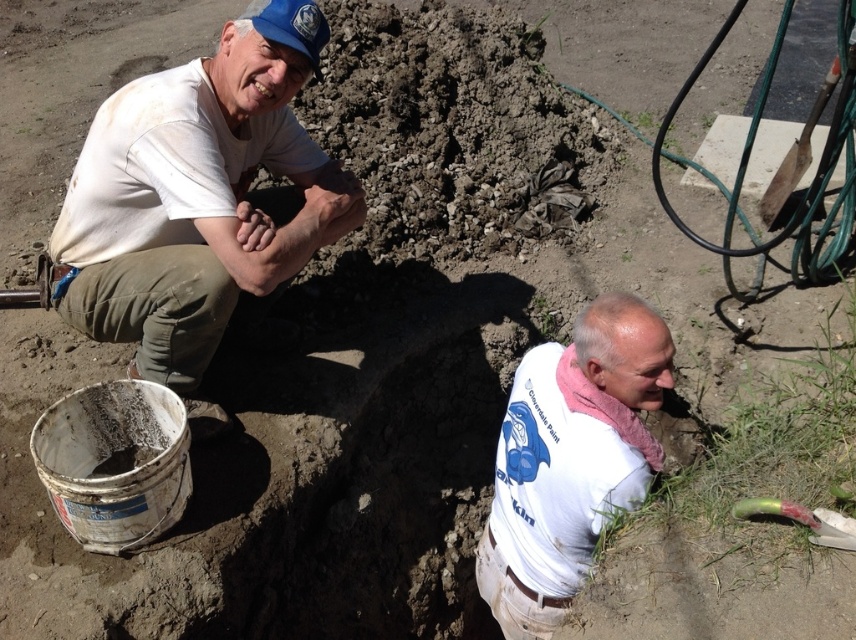
Describe the element at coordinates (199, 200) in the screenshot. I see `white matte shirt at upper left` at that location.

Identify the location of white matte shirt at upper left. This screenshot has height=640, width=856. (199, 200).

This screenshot has width=856, height=640. Find the location of `white matte shirt at upper left`. white matte shirt at upper left is located at coordinates (199, 200).